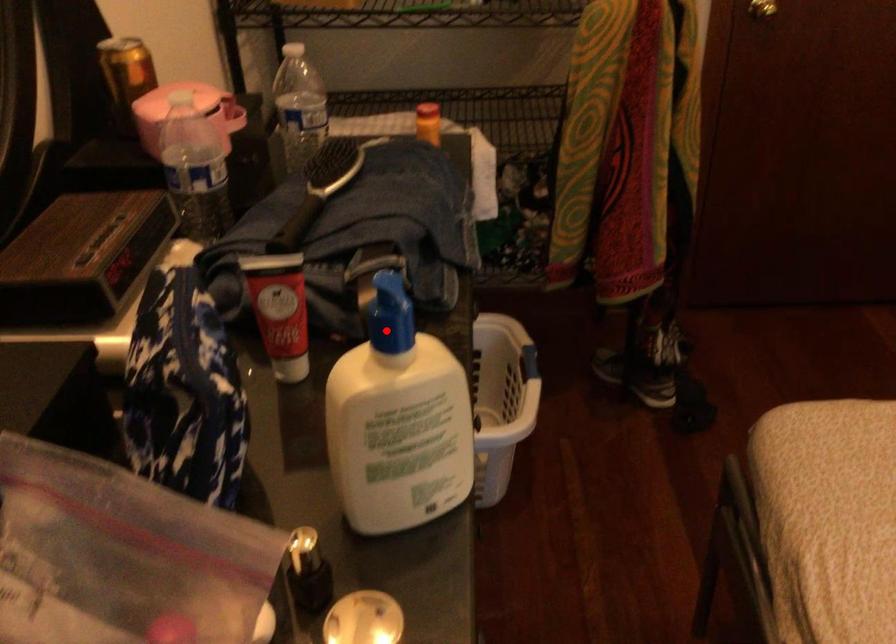
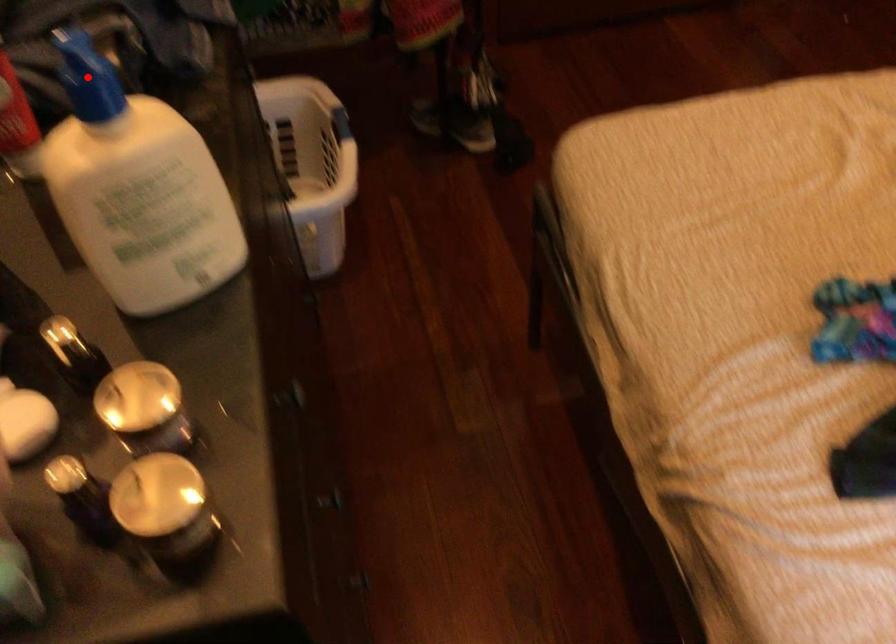
I am providing you with two images of the same scene from different viewpoints. A red point is marked on the first image and another point is marked on the second image. Do the highlighted points in image1 and image2 indicate the same real-world spot?

Yes